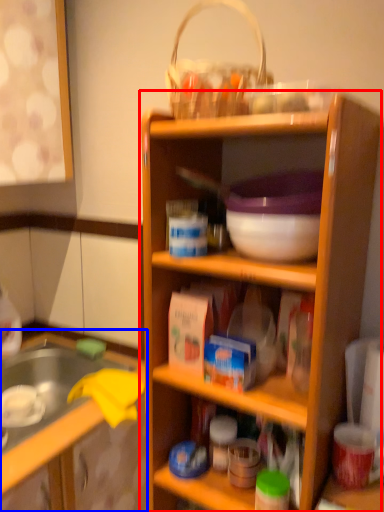
Question: Which point is further to the camera, shelf (highlighted by a red box) or cabinetry (highlighted by a blue box)?

Choices:
 (A) shelf
 (B) cabinetry

Answer: (B)